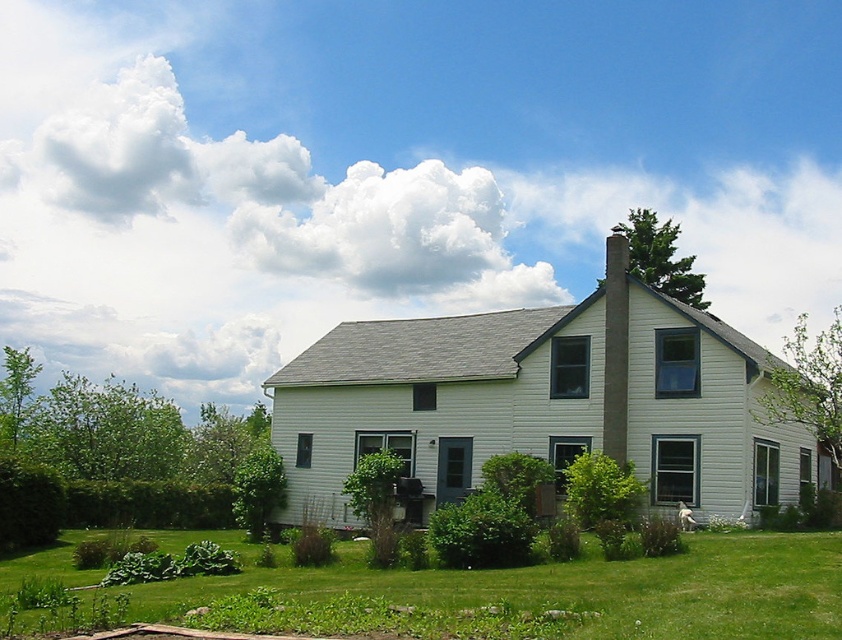
You are standing in front of the house and want to walk towards the smooth concrete chimney at center. Which direction should you move relative to the green grass at lower center?

Since the green grass at lower center is closer to the viewer than the smooth concrete chimney at center, you should move away from the green grass at lower center to reach the smooth concrete chimney at center.

You are a gardener who wants to mow the green grass at lower center. However, there is a smooth concrete chimney at center in the way. Can you mow the grass around the chimney without hitting it?

The green grass at lower center is shorter than the smooth concrete chimney at center, so yes, you can mow the grass around the chimney without hitting it since the chimney is taller than the grass.

You are standing in front of the house and want to walk towards the smooth concrete chimney at center. Which direction should you move relative to the green grass at lower center?

To reach the smooth concrete chimney at center from the green grass at lower center, you should move to the right since the green grass at lower center is located to the left of the chimney.